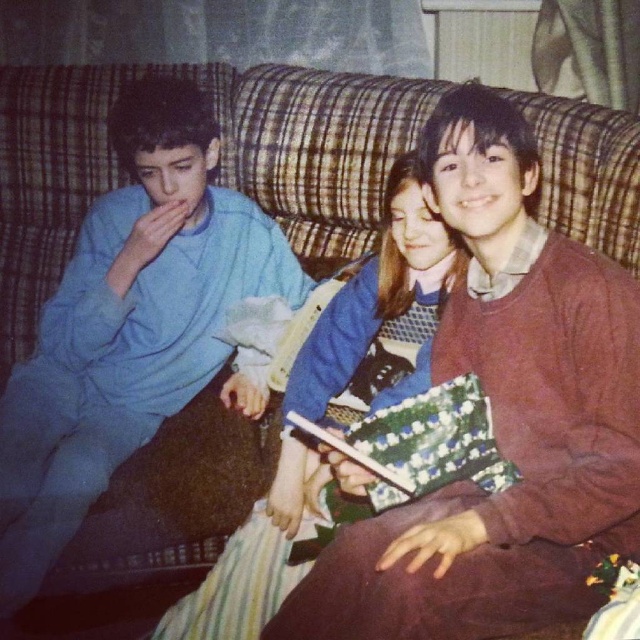
Is point (88, 349) positioned behind point (292, 480)?

Yes, point (88, 349) is behind point (292, 480).

Where is `matte blue sweater at left`? This screenshot has height=640, width=640. matte blue sweater at left is located at coordinates (129, 323).

The width and height of the screenshot is (640, 640). What are the coordinates of `matte blue sweater at left` in the screenshot? It's located at (129, 323).